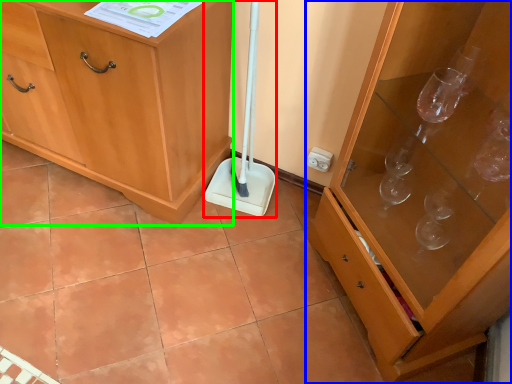
Question: Which is farther away from shovel (highlighted by a red box)? cabinetry (highlighted by a blue box) or cabinetry (highlighted by a green box)?

Choices:
 (A) cabinetry
 (B) cabinetry

Answer: (A)